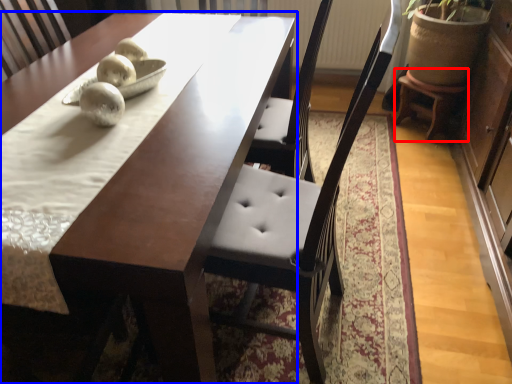
Question: Which of the following is the closest to the observer, stool (highlighted by a red box) or table (highlighted by a blue box)?

Choices:
 (A) stool
 (B) table

Answer: (B)